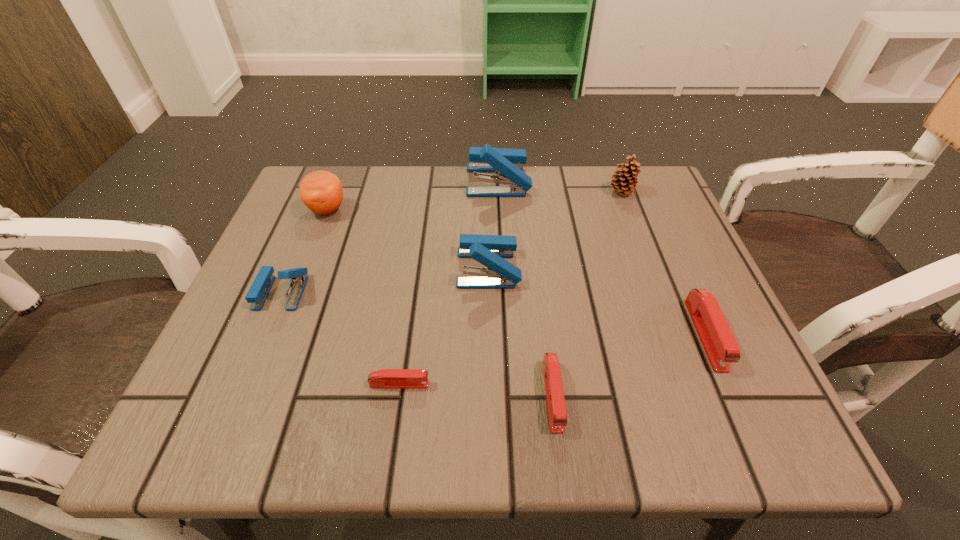
The width and height of the screenshot is (960, 540). In order to click on stapler located at the far edge in this screenshot , I will do `click(508, 163)`.

Locate an element on the screen. The height and width of the screenshot is (540, 960). orange present at the far edge is located at coordinates (321, 191).

Where is `pinecone present at the far edge`? The height and width of the screenshot is (540, 960). pinecone present at the far edge is located at coordinates (623, 184).

Identify the location of orange positioned at the left edge. (321, 191).

Find the location of a particular element. The image size is (960, 540). stapler positioned at the left edge is located at coordinates (261, 286).

Where is `pinecone present at the right edge`? pinecone present at the right edge is located at coordinates (623, 184).

Image resolution: width=960 pixels, height=540 pixels. I want to click on stapler at the right edge, so click(x=718, y=341).

You are a GUI agent. You are given a task and a screenshot of the screen. Output one action in this format:
    pyautogui.click(x=<x>, y=<y>)
    Task: Click on the object that is positioned at the far left corner
    
    Given the screenshot: What is the action you would take?
    (x=321, y=191)

This screenshot has height=540, width=960. Identify the location of object positioned at the far right corner. (623, 184).

Locate an element on the screen. vacant region at the far edge of the desktop is located at coordinates (459, 196).